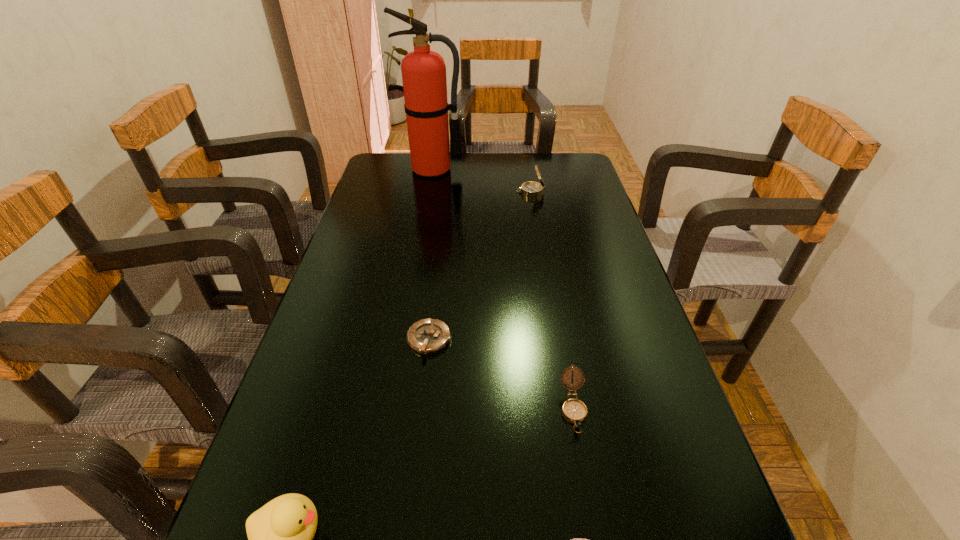
In order to click on vacant space at the far left corner of the desktop in this screenshot , I will do `click(410, 177)`.

This screenshot has height=540, width=960. I want to click on vacant space at the far right corner of the desktop, so click(575, 171).

You are a GUI agent. You are given a task and a screenshot of the screen. Output one action in this format:
    pyautogui.click(x=<x>, y=<y>)
    Task: Click on the unoccupied area between the second farthest object and the shortest object
    
    Given the screenshot: What is the action you would take?
    pyautogui.click(x=480, y=266)

Where is `free space between the third nearest object and the taller compass`? This screenshot has width=960, height=540. free space between the third nearest object and the taller compass is located at coordinates (552, 300).

Where is `unoccupied area between the tallest object and the shortest object`? This screenshot has width=960, height=540. unoccupied area between the tallest object and the shortest object is located at coordinates (431, 254).

Image resolution: width=960 pixels, height=540 pixels. In order to click on vacant area that lies between the fourth tallest object and the farther compass in this screenshot , I will do (x=552, y=300).

Where is `unoccupied area between the third farthest object and the taller compass`? This screenshot has height=540, width=960. unoccupied area between the third farthest object and the taller compass is located at coordinates (480, 266).

The image size is (960, 540). Identify the location of object that is the third closest one to the third nearest object. (280, 534).

Identify which object is the fourth closest to the farthest object. Please provide its 2D coordinates. Your answer should be formatted as a tuple, i.e. [(x, y)], where the tuple contains the x and y coordinates of a point satisfying the conditions above.

[(280, 534)]

The image size is (960, 540). Identify the location of free space that satisfies the following two spatial constraints: 1. at the nozzle of the tallest object; 2. on the right side of the third farthest object. (404, 340).